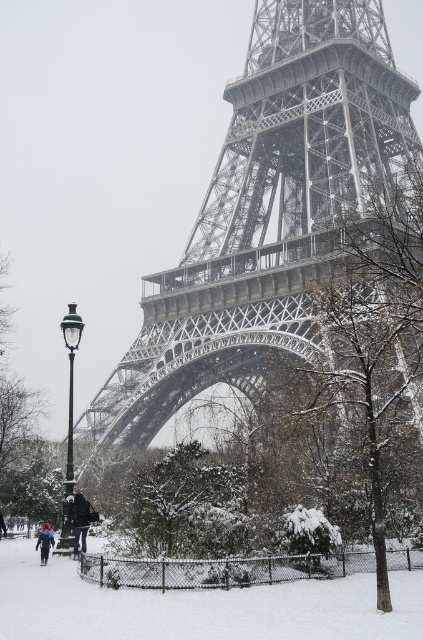
Question: Estimate the real-world distances between objects in this image. Which object is farther from the metallic gray eiffel tower at center?

Choices:
 (A) black matte jacket at lower left
 (B) snow-covered snowboarder at lower left

Answer: (B)

Question: Can you confirm if black matte jacket at lower left is smaller than snow-covered snowboarder at lower left?

Choices:
 (A) no
 (B) yes

Answer: (B)

Question: Among these objects, which one is nearest to the camera?

Choices:
 (A) metallic gray eiffel tower at center
 (B) black matte jacket at lower left

Answer: (A)

Question: Is metallic gray eiffel tower at center in front of snow-covered snowboarder at lower left?

Choices:
 (A) yes
 (B) no

Answer: (A)

Question: Does metallic gray eiffel tower at center have a larger size compared to snow-covered snowboarder at lower left?

Choices:
 (A) yes
 (B) no

Answer: (A)

Question: Which point appears closest to the camera in this image?

Choices:
 (A) (96, 513)
 (B) (343, 45)

Answer: (A)